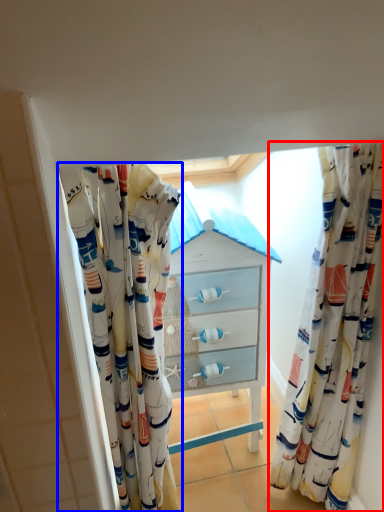
Question: Which object appears closest to the camera in this image, curtain (highlighted by a red box) or curtain (highlighted by a blue box)?

Choices:
 (A) curtain
 (B) curtain

Answer: (B)